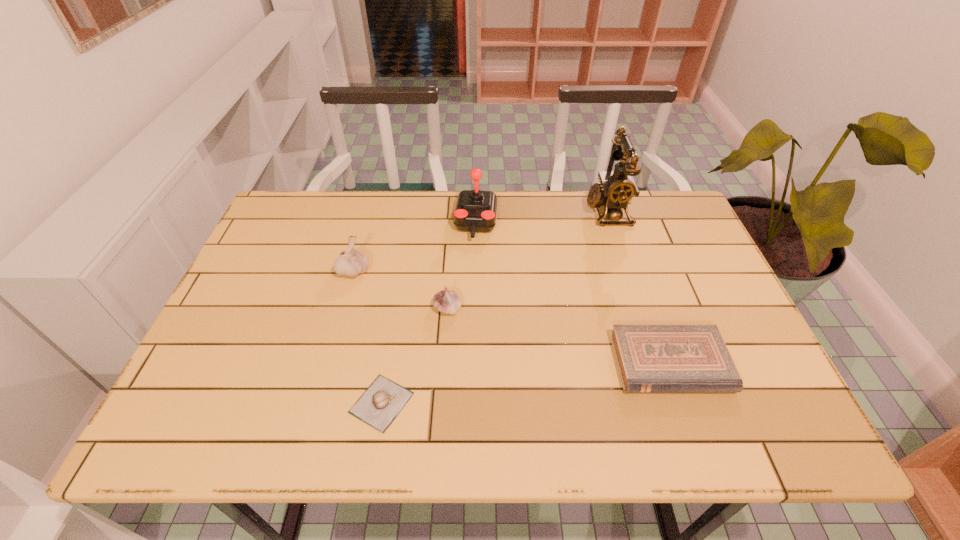
Identify the location of object positioned at the right edge. The height and width of the screenshot is (540, 960). (650, 358).

Where is `free space at the far edge`? Image resolution: width=960 pixels, height=540 pixels. free space at the far edge is located at coordinates (497, 237).

The height and width of the screenshot is (540, 960). Find the location of `blank space at the near edge`. blank space at the near edge is located at coordinates (335, 417).

In the image, there is a desktop. At what (x,y) coordinates should I click in order to perform the action: click on vacant region at the left edge. Please return your answer as a coordinate pair (x, y). Looking at the image, I should click on (289, 299).

This screenshot has height=540, width=960. In order to click on vacant area at the far left corner of the desktop in this screenshot , I will do `click(305, 207)`.

Where is `vacant space at the far right corner`? The width and height of the screenshot is (960, 540). vacant space at the far right corner is located at coordinates (649, 211).

Identify the location of blank region between the second farthest garlic and the joystick. (462, 266).

Find the location of a particular element. vacant area between the Bible and the tallest garlic is located at coordinates (512, 317).

Identify the location of vacant space that's between the tallest object and the fifth shortest object. The image size is (960, 540). (541, 217).

In order to click on vacant point located between the tallest object and the second tallest object in this screenshot , I will do `click(541, 217)`.